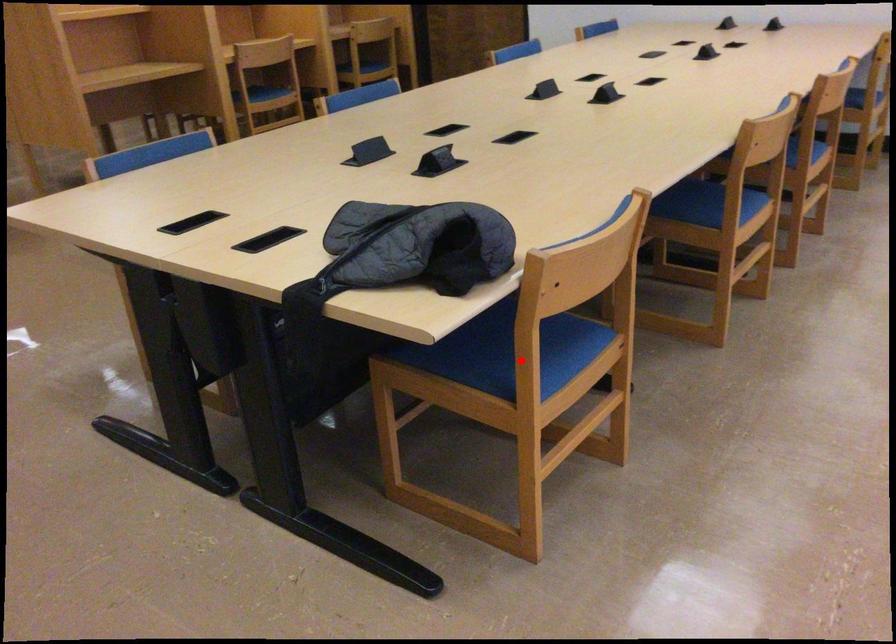
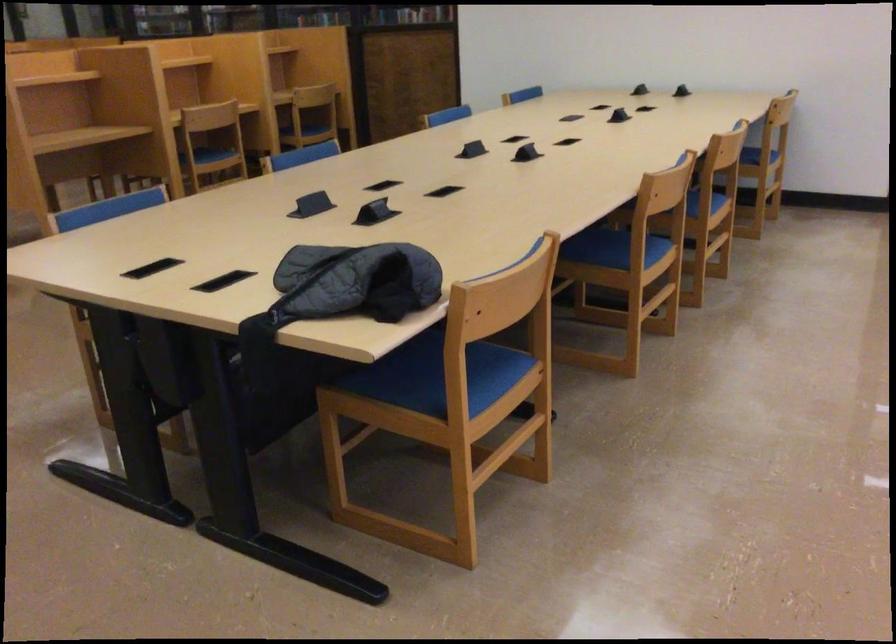
The point at the highlighted location is marked in the first image. Where is the corresponding point in the second image?

(451, 381)